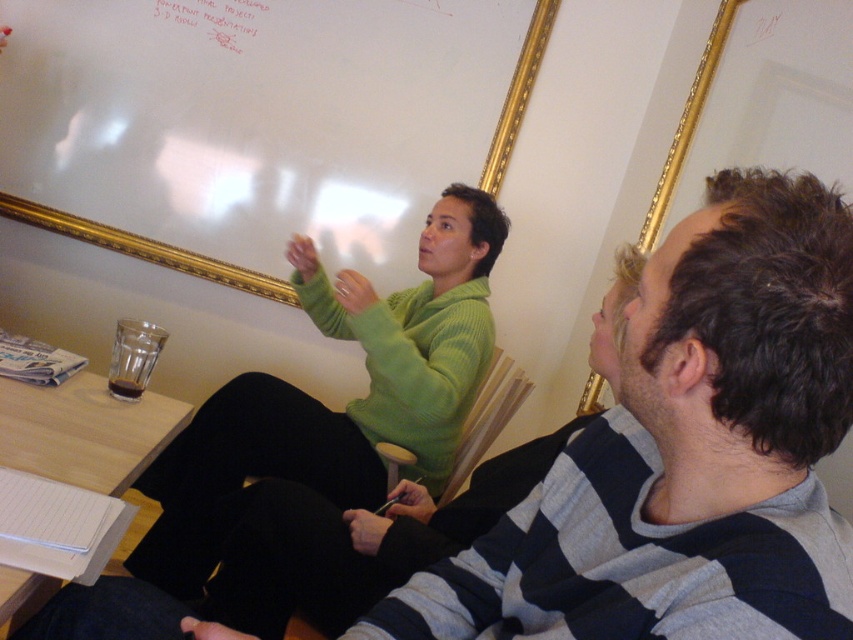
You are standing in the room and want to write something on the whiteboard at upper left. Considering the whiteboard is at point 0.389 on the x and 0.169 on the y coordinates, can you estimate its position relative to the two people?

The whiteboard at upper left is positioned at coordinates x 0.389 and y 0.169, which places it above and to the left of the two individuals in the room.

You are an assistant in a meeting room. You need to write a note for the attendees. Which object, the whiteboard at upper left or the white paper at upper center, would you choose to write on, considering their sizes?

The whiteboard at upper left is larger in size than the white paper at upper center, so you should choose the whiteboard at upper left to write on because it provides more space for notes.

You are an attendee at a meeting and need to refer to the whiteboard at upper left and the white paper at upper center. Which one is higher up?

The white paper at upper center is higher up than the whiteboard at upper left because the whiteboard at upper left is below white paper at upper center.